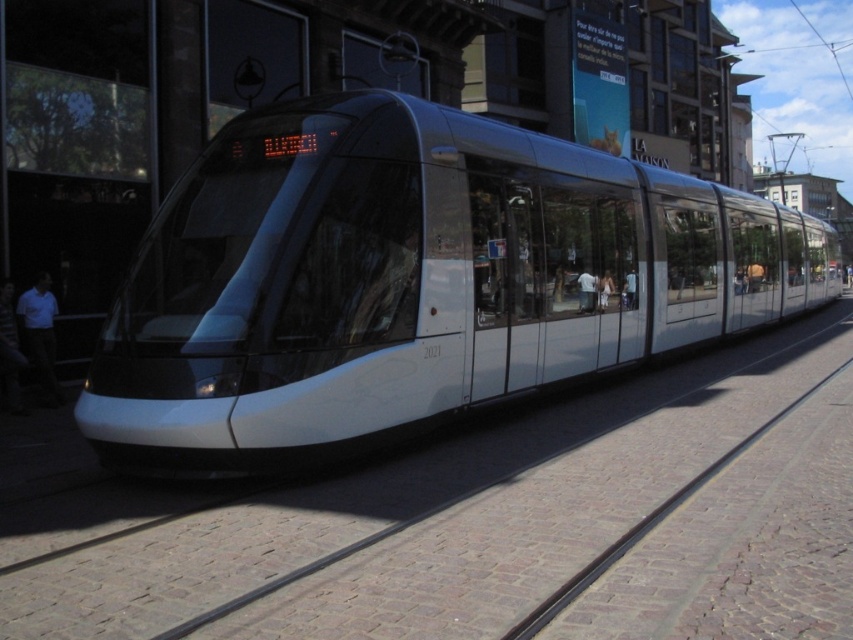
How distant is white glossy train at center from white matte shirt at left?

A distance of 7.25 meters exists between white glossy train at center and white matte shirt at left.

Can you confirm if white glossy train at center is positioned to the right of white matte shirt at left?

Yes, white glossy train at center is to the right of white matte shirt at left.

Between point (325, 308) and point (28, 288), which one is positioned in front?

Point (325, 308)

This screenshot has width=853, height=640. What are the coordinates of `white glossy train at center` in the screenshot? It's located at (412, 280).